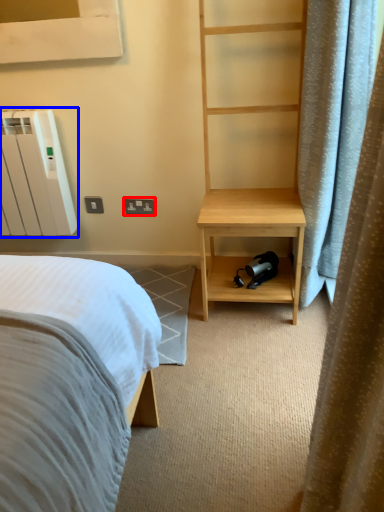
Question: Which of the following is the closest to the observer, electric outlet (highlighted by a red box) or radiator (highlighted by a blue box)?

Choices:
 (A) electric outlet
 (B) radiator

Answer: (B)